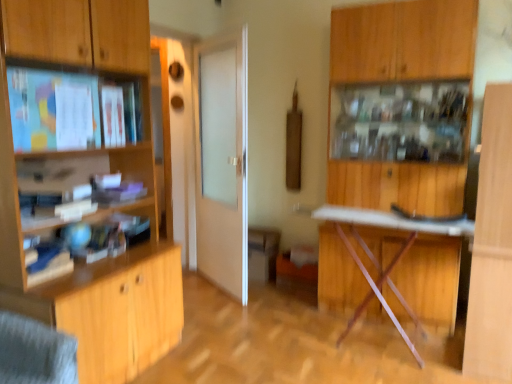
Question: Is wooden cabinet at center, acting as the second cabinetry starting from the left, bigger or smaller than wooden cabinet at left, which is counted as the 2th cabinetry, starting from the right?

Choices:
 (A) small
 (B) big

Answer: (A)

Question: Is point pyautogui.click(x=254, y=248) closer or farther from the camera than point pyautogui.click(x=111, y=316)?

Choices:
 (A) closer
 (B) farther

Answer: (B)

Question: Which is nearer to the matte wooden shelf at upper left?

Choices:
 (A) wooden cabinet at center, placed as the first cabinetry when sorted from back to front
 (B) wooden cabinet at upper right
 (C) white frosted glass door at center
 (D) metallic silver table at center
 (E) wooden cabinet at left, which appears as the 2th cabinetry when viewed from the back

Answer: (E)

Question: Estimate the real-world distances between objects in this image. Which object is closer to the wooden cabinet at upper right?

Choices:
 (A) wooden cabinet at left, which is the first cabinetry from left to right
 (B) white frosted glass door at center
 (C) wooden cabinet at center, the first cabinetry when ordered from right to left
 (D) metallic silver table at center
 (E) matte wooden shelf at upper left

Answer: (D)